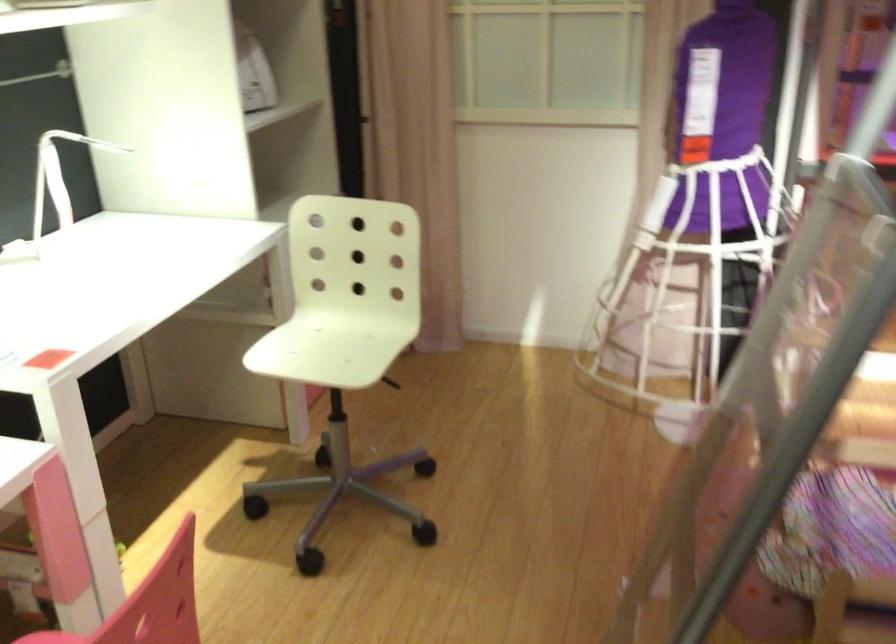
The location [58,176] corresponds to which object?

This point indicates the white desk lamp.